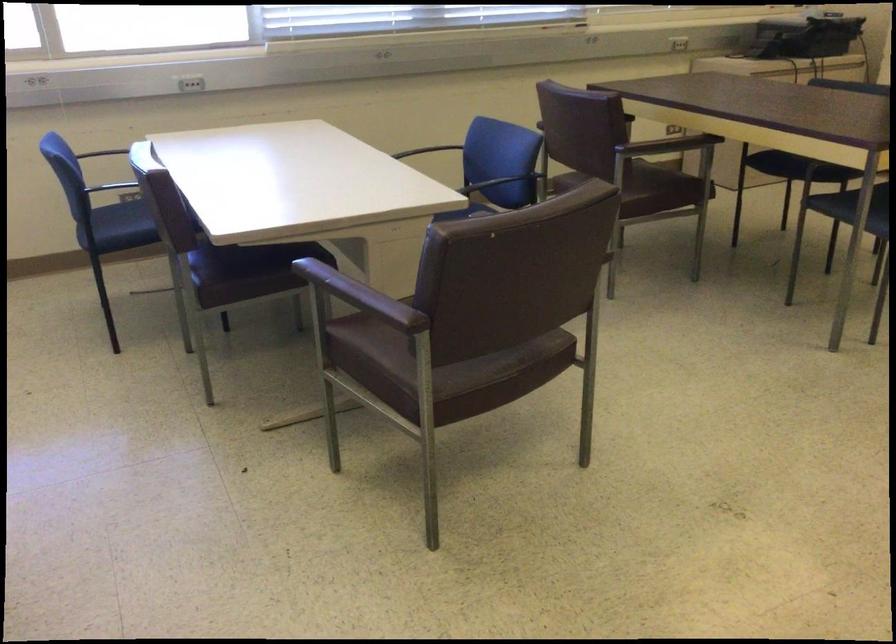
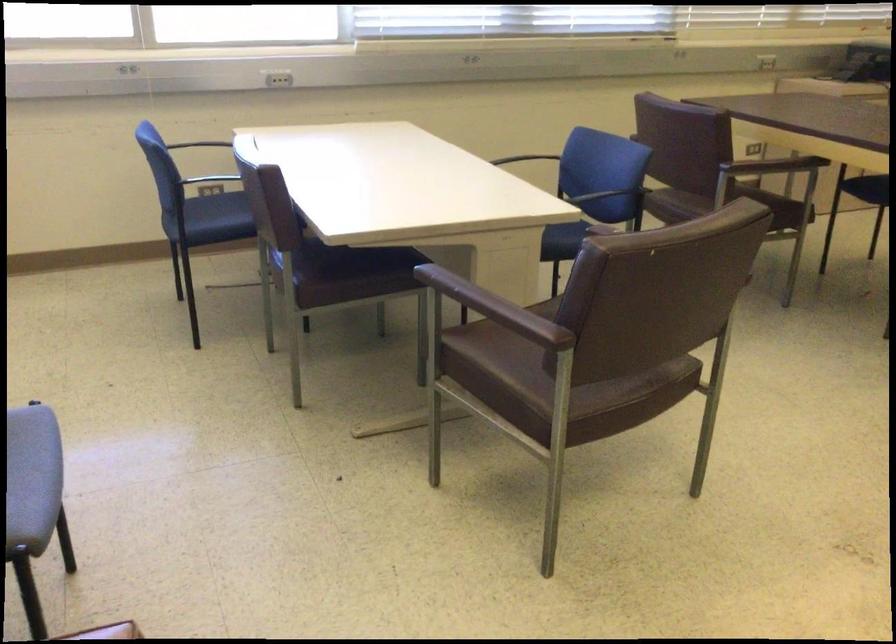
Where in the second image is the point corresponding to (x=442, y=149) from the first image?

(521, 158)